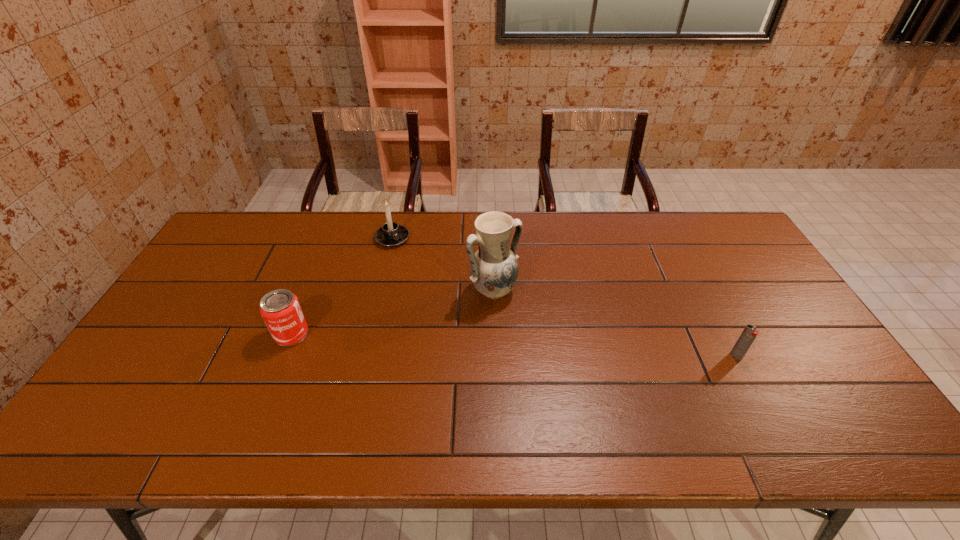
This screenshot has width=960, height=540. In order to click on free space located 0.320m with a handle on the side of the third object from right to left in this screenshot , I will do coord(446,306).

Where is `free region located 0.150m with a handle on the side of the third object from right to left`? This screenshot has height=540, width=960. free region located 0.150m with a handle on the side of the third object from right to left is located at coordinates (420, 273).

The height and width of the screenshot is (540, 960). I want to click on free space located 0.210m with a handle on the side of the third object from right to left, so click(x=428, y=284).

Identify the location of free space located 0.230m on either side of the third object from left to right. (562, 357).

In order to click on free space located 0.330m on either side of the third object from left to right in this screenshot , I will do `click(588, 383)`.

You are a GUI agent. You are given a task and a screenshot of the screen. Output one action in this format:
    pyautogui.click(x=<x>, y=<y>)
    Task: Click on the vacant space located on either side of the third object from left to right
    
    Given the screenshot: What is the action you would take?
    pyautogui.click(x=569, y=364)

Find the location of a particular element. Image resolution: width=960 pixels, height=540 pixels. object present at the far edge is located at coordinates (391, 234).

Find the location of a particular element. The width and height of the screenshot is (960, 540). vacant space at the far edge of the desktop is located at coordinates (692, 234).

The image size is (960, 540). In the image, there is a desktop. Identify the location of vacant space at the near edge. (679, 389).

In the image, there is a desktop. Where is `blank space at the left edge`? The height and width of the screenshot is (540, 960). blank space at the left edge is located at coordinates (204, 282).